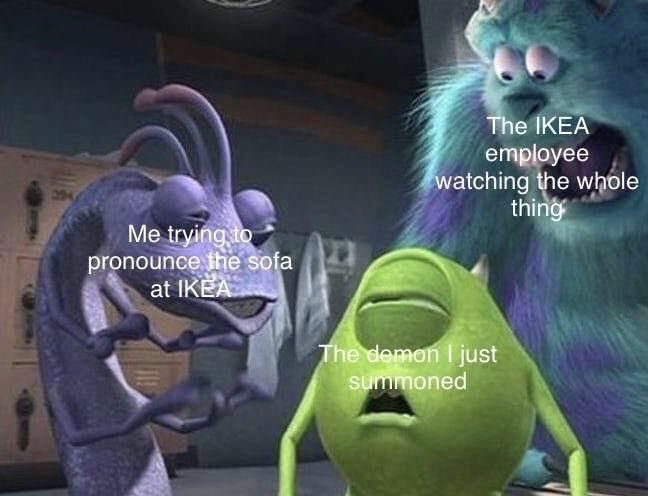
Locate an element on the screen. This screenshot has width=648, height=496. wall is located at coordinates (315, 183).